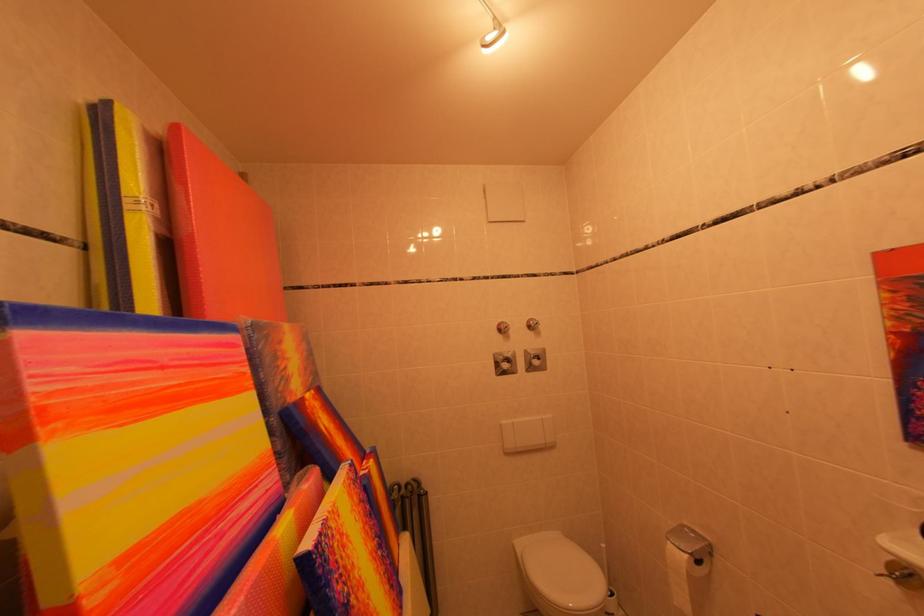
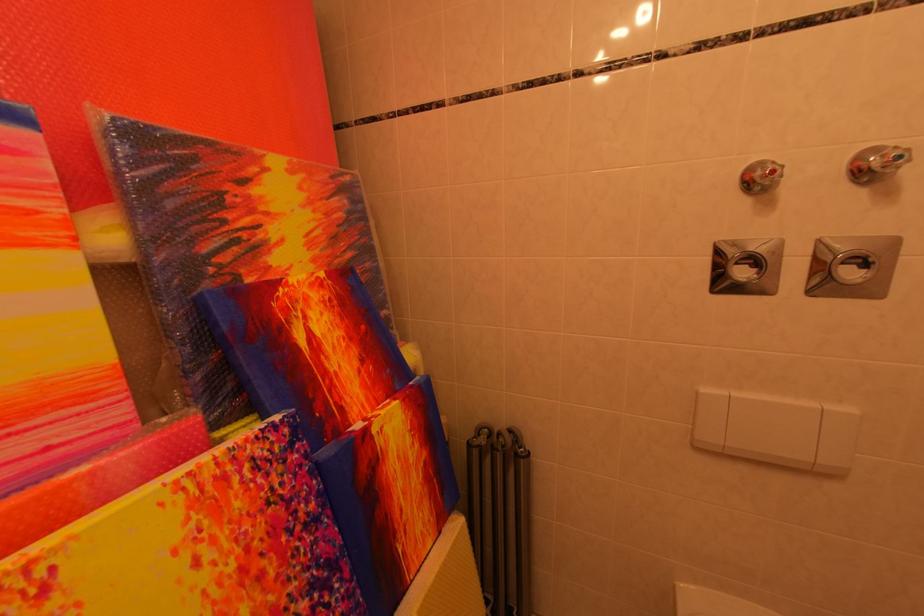
Where in the second image is the point corresponding to (287,371) from the first image?

(233, 225)